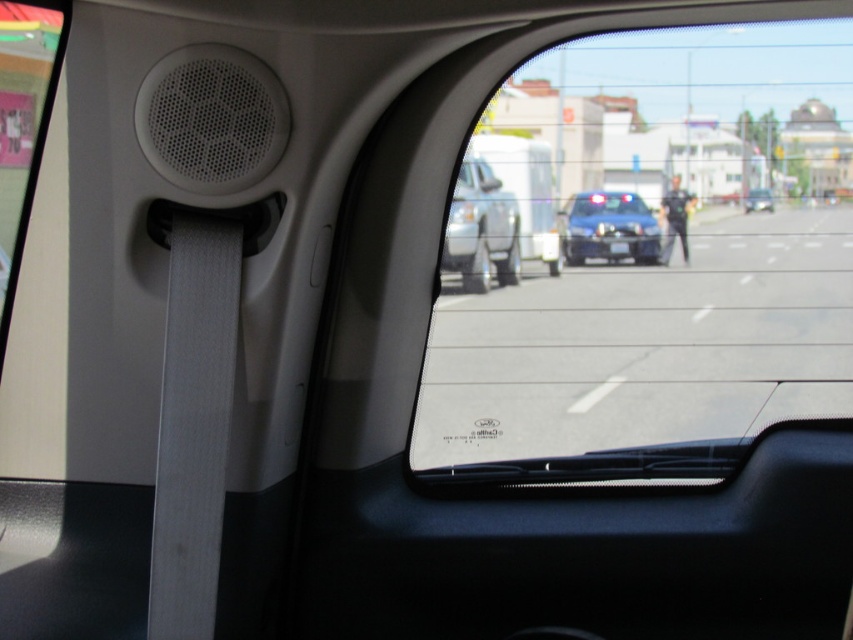
Question: Estimate the real-world distances between objects in this image. Which object is closer to the transparent plastic windshield at center?

Choices:
 (A) metallic silver van at center
 (B) metallic blue sedan at center

Answer: (A)

Question: Among these objects, which one is nearest to the camera?

Choices:
 (A) transparent plastic windshield at center
 (B) clear plastic mirror at center
 (C) metallic silver van at center
 (D) metallic blue sedan at center

Answer: (A)

Question: Is transparent plastic windshield at center above blue metallic police car at center?

Choices:
 (A) yes
 (B) no

Answer: (B)

Question: Does metallic silver van at center have a smaller size compared to blue metallic police car at center?

Choices:
 (A) yes
 (B) no

Answer: (B)

Question: Does blue metallic police car at center have a greater width compared to metallic blue sedan at center?

Choices:
 (A) yes
 (B) no

Answer: (A)

Question: Which point is closer to the camera taking this photo?

Choices:
 (A) (482, 182)
 (B) (828, 296)
 (C) (764, 200)

Answer: (B)